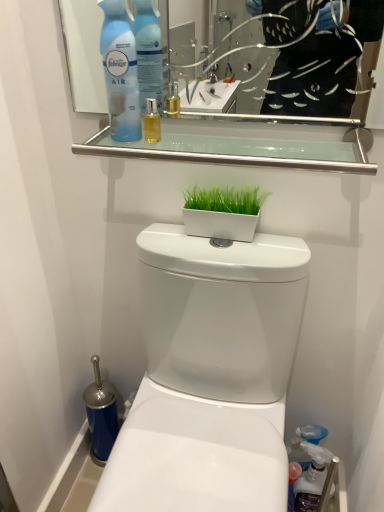
You are a GUI agent. You are given a task and a screenshot of the screen. Output one action in this format:
    pyautogui.click(x=<x>, y=<y>)
    Task: Click on the free spot below clear glass shelf at upper center (from a real-world perspective)
    This screenshot has height=512, width=384.
    Given the screenshot: What is the action you would take?
    pyautogui.click(x=220, y=247)